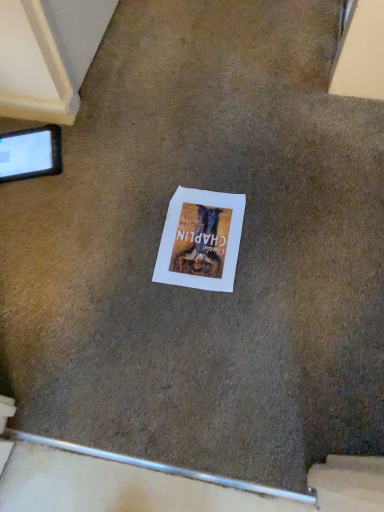
Where is `free location to the left of white paper at center`? free location to the left of white paper at center is located at coordinates (112, 245).